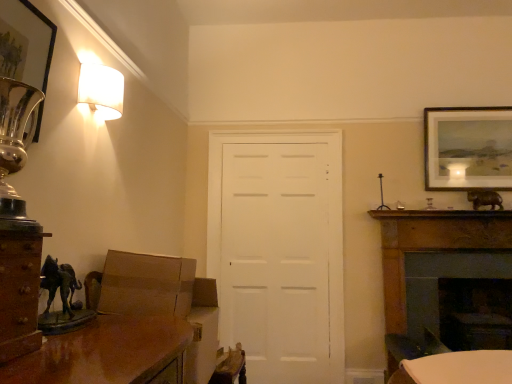
Question: From the image's perspective, is white matte door at center on brown wood cabinet at left?

Choices:
 (A) yes
 (B) no

Answer: (B)

Question: Is white matte door at center to the right of brown wood cabinet at left from the viewer's perspective?

Choices:
 (A) no
 (B) yes

Answer: (B)

Question: Is white matte door at center facing away from brown wood cabinet at left?

Choices:
 (A) no
 (B) yes

Answer: (A)

Question: Is white matte door at center far away from brown wood cabinet at left?

Choices:
 (A) yes
 (B) no

Answer: (A)

Question: Considering the relative sizes of white matte door at center and brown wood cabinet at left in the image provided, is white matte door at center wider than brown wood cabinet at left?

Choices:
 (A) no
 (B) yes

Answer: (A)

Question: From a real-world perspective, relative to metallic silver picture frame at upper left, placed as the first picture frame when sorted from front to back, is white glossy table at lower right vertically above or below?

Choices:
 (A) below
 (B) above

Answer: (A)

Question: From the image's perspective, is white glossy table at lower right positioned above or below metallic silver picture frame at upper left, the second picture frame when ordered from back to front?

Choices:
 (A) above
 (B) below

Answer: (B)

Question: Considering the positions of white glossy table at lower right and metallic silver picture frame at upper left, placed as the first picture frame when sorted from front to back, in the image, is white glossy table at lower right bigger or smaller than metallic silver picture frame at upper left, placed as the first picture frame when sorted from front to back,?

Choices:
 (A) big
 (B) small

Answer: (A)

Question: Is point (432, 372) positioned closer to the camera than point (19, 39)?

Choices:
 (A) closer
 (B) farther

Answer: (B)

Question: Relative to matte gold picture frame at upper right, the first picture frame viewed from the back, is metallic silver picture frame at upper left, the second picture frame when ordered from back to front, in front or behind?

Choices:
 (A) behind
 (B) front

Answer: (B)

Question: From a real-world perspective, is metallic silver picture frame at upper left, the second picture frame when ordered from back to front, above or below matte gold picture frame at upper right, the first picture frame from the right?

Choices:
 (A) above
 (B) below

Answer: (B)

Question: Visually, is metallic silver picture frame at upper left, the second picture frame when ordered from back to front, positioned to the left or to the right of matte gold picture frame at upper right, the second picture frame positioned from the front?

Choices:
 (A) left
 (B) right

Answer: (A)

Question: Is metallic silver picture frame at upper left, acting as the 1th picture frame starting from the left, bigger or smaller than matte gold picture frame at upper right, the first picture frame viewed from the back?

Choices:
 (A) small
 (B) big

Answer: (A)

Question: In terms of height, does matte gold picture frame at upper right, the second picture frame from the left, look taller or shorter compared to white matte door at center?

Choices:
 (A) short
 (B) tall

Answer: (A)

Question: Is point (480, 173) closer or farther from the camera than point (229, 289)?

Choices:
 (A) farther
 (B) closer

Answer: (B)